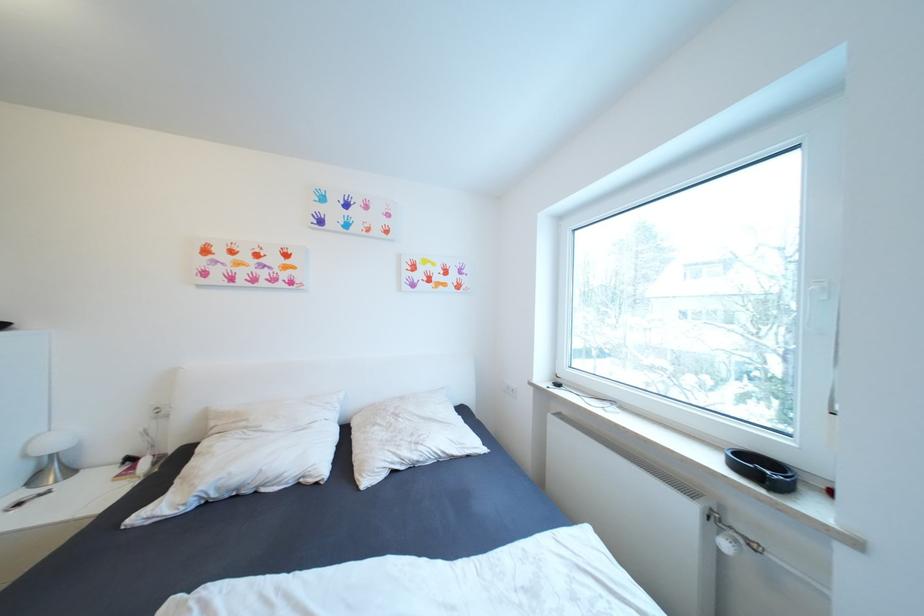
Where is `black tray`? This screenshot has height=616, width=924. black tray is located at coordinates (761, 469).